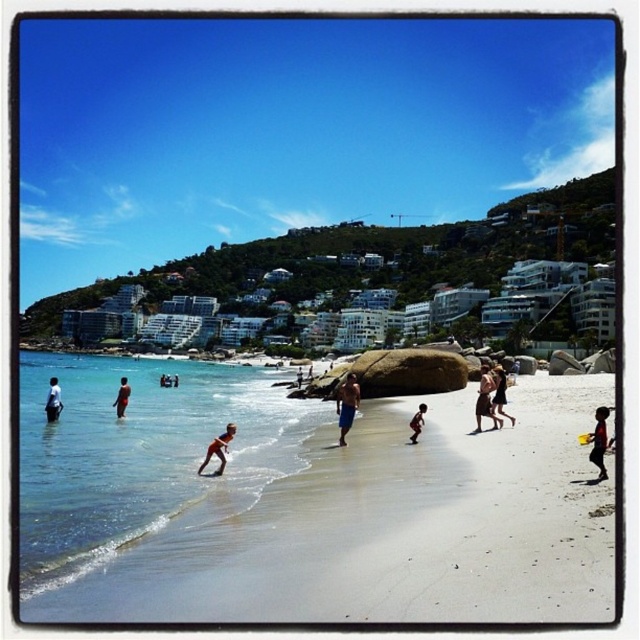
You are a photographer trying to capture a photo of the tan skin person at lower center and the silhouette wooden stick at center in the beach scene. Based on their sizes, which object will appear bigger in your photo?

The tan skin person at lower center will appear bigger in the photo because they have a larger size compared to the silhouette wooden stick at center.